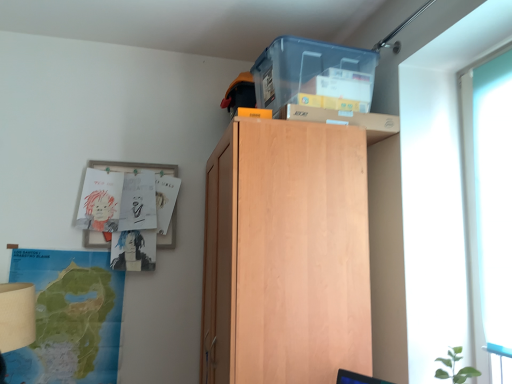
What do you see at coordinates (314, 75) in the screenshot? I see `transparent plastic storage box at upper center` at bounding box center [314, 75].

What do you see at coordinates (286, 254) in the screenshot?
I see `light wood cabinet at upper center` at bounding box center [286, 254].

You are a GUI agent. You are given a task and a screenshot of the screen. Output one action in this format:
    pyautogui.click(x=<x>, y=<y>)
    Task: Click on the green paper map at lower left
    
    Given the screenshot: What is the action you would take?
    pyautogui.click(x=69, y=317)

How many degrees apart are the facing directions of transparent plastic storage box at upper center and transparent glass door at right?

transparent plastic storage box at upper center and transparent glass door at right are facing 5.4 degrees away from each other.

Is transparent plastic storage box at upper center directly adjacent to transparent glass door at right?

No, transparent plastic storage box at upper center is not in contact with transparent glass door at right.

Is transparent plastic storage box at upper center inside the boundaries of transparent glass door at right, or outside?

transparent plastic storage box at upper center lies outside transparent glass door at right.

Is transparent plastic storage box at upper center turned away from transparent glass door at right?

transparent plastic storage box at upper center does not have its back to transparent glass door at right.

How many degrees apart are the facing directions of transparent glass door at right and light wood cabinet at upper center?

0.425 degrees.

Between transparent glass door at right and light wood cabinet at upper center, which one has less height?

transparent glass door at right.

Does transparent glass door at right come behind light wood cabinet at upper center?

That is False.

Which is farther from the camera, (339,179) or (478,327)?

The point (478,327) is behind.

From a real-world perspective, who is located lower, light wood cabinet at upper center or transparent glass door at right?

light wood cabinet at upper center, from a real-world perspective.

What's the angular difference between light wood cabinet at upper center and transparent glass door at right's facing directions?

The angular difference between light wood cabinet at upper center and transparent glass door at right is 0.425 degrees.

Is light wood cabinet at upper center in front of or behind transparent glass door at right in the image?

Visually, light wood cabinet at upper center is located behind transparent glass door at right.

Which object is more forward, green paper map at lower left or light wood cabinet at upper center?

light wood cabinet at upper center is more forward.

Is green paper map at lower left shorter than light wood cabinet at upper center?

Indeed, green paper map at lower left has a lesser height compared to light wood cabinet at upper center.

Is green paper map at lower left thinner than light wood cabinet at upper center?

Yes.

The image size is (512, 384). Find the location of `cabinetry located in front of the green paper map at lower left`. cabinetry located in front of the green paper map at lower left is located at coordinates (286, 254).

Is green paper map at lower left outside of transparent plastic storage box at upper center?

Yes, green paper map at lower left is outside of transparent plastic storage box at upper center.

Considering their positions, is green paper map at lower left located in front of or behind transparent plastic storage box at upper center?

green paper map at lower left is positioned farther from the viewer than transparent plastic storage box at upper center.

Is green paper map at lower left oriented towards transparent plastic storage box at upper center?

No, green paper map at lower left is not aimed at transparent plastic storage box at upper center.

Considering the sizes of objects green paper map at lower left and transparent plastic storage box at upper center in the image provided, who is smaller, green paper map at lower left or transparent plastic storage box at upper center?

green paper map at lower left is smaller.

Considering the relative sizes of light wood cabinet at upper center and transparent plastic storage box at upper center in the image provided, is light wood cabinet at upper center shorter than transparent plastic storage box at upper center?

In fact, light wood cabinet at upper center may be taller than transparent plastic storage box at upper center.

Considering the sizes of objects light wood cabinet at upper center and transparent plastic storage box at upper center in the image provided, who is bigger, light wood cabinet at upper center or transparent plastic storage box at upper center?

With larger size is light wood cabinet at upper center.

Can you tell me how much light wood cabinet at upper center and transparent plastic storage box at upper center differ in facing direction?

light wood cabinet at upper center and transparent plastic storage box at upper center are facing 4.98 degrees away from each other.

Is point (483, 284) more distant than point (81, 316)?

No, (483, 284) is in front of (81, 316).

From a real-world perspective, is transparent glass door at right under green paper map at lower left?

No, from a real-world perspective, transparent glass door at right is not below green paper map at lower left.

Which object is positioned more to the right, transparent glass door at right or green paper map at lower left?

transparent glass door at right is more to the right.

What are the coordinates of `storage box that is behind the transparent glass door at right` in the screenshot? It's located at (314, 75).

Locate an element on the screen. This screenshot has height=384, width=512. cabinetry that appears on the left of transparent glass door at right is located at coordinates (286, 254).

Looking at the image, which one is located closer to transparent plastic storage box at upper center, light wood cabinet at upper center or green paper map at lower left?

light wood cabinet at upper center.

Which object lies nearer to the anchor point green paper map at lower left, light wood cabinet at upper center or transparent glass door at right?

The object closer to green paper map at lower left is light wood cabinet at upper center.

Considering their positions, is green paper map at lower left positioned closer to transparent plastic storage box at upper center than transparent glass door at right?

The object closer to transparent plastic storage box at upper center is transparent glass door at right.

From the image, which object appears to be nearer to light wood cabinet at upper center, transparent plastic storage box at upper center or transparent glass door at right?

Based on the image, transparent plastic storage box at upper center appears to be nearer to light wood cabinet at upper center.

When comparing their distances from green paper map at lower left, does transparent plastic storage box at upper center or transparent glass door at right seem closer?

transparent plastic storage box at upper center.

Based on their spatial positions, is transparent glass door at right or light wood cabinet at upper center closer to transparent plastic storage box at upper center?

light wood cabinet at upper center is positioned closer to the anchor transparent plastic storage box at upper center.

Considering their positions, is transparent glass door at right positioned closer to light wood cabinet at upper center than transparent plastic storage box at upper center?

transparent plastic storage box at upper center.

Considering their positions, is transparent glass door at right positioned closer to transparent plastic storage box at upper center than green paper map at lower left?

transparent glass door at right.

Find the location of a particular element. storage box located between green paper map at lower left and transparent glass door at right in the left-right direction is located at coordinates (314, 75).

This screenshot has width=512, height=384. I want to click on cabinetry between green paper map at lower left and transparent glass door at right from left to right, so click(x=286, y=254).

Locate an element on the screen. Image resolution: width=512 pixels, height=384 pixels. glass door between transparent plastic storage box at upper center and light wood cabinet at upper center in the vertical direction is located at coordinates pos(489,209).

This screenshot has height=384, width=512. Find the location of `cabinetry located between green paper map at lower left and transparent plastic storage box at upper center in the left-right direction`. cabinetry located between green paper map at lower left and transparent plastic storage box at upper center in the left-right direction is located at coordinates (286, 254).